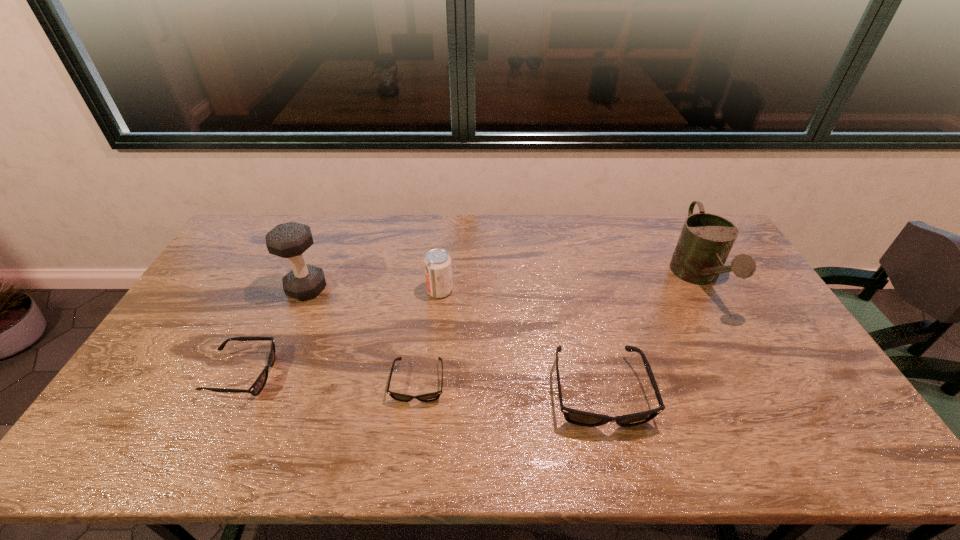
Locate an element on the screen. The width and height of the screenshot is (960, 540). the second tallest sunglasses is located at coordinates (258, 385).

The width and height of the screenshot is (960, 540). I want to click on the leftmost sunglasses, so pos(258,385).

Find the location of a particular element. the second sunglasses from right to left is located at coordinates (429, 397).

Where is `the shortest object`? the shortest object is located at coordinates (429, 397).

Locate an element on the screen. Image resolution: width=960 pixels, height=540 pixels. the second object from right to left is located at coordinates (576, 417).

You are a GUI agent. You are given a task and a screenshot of the screen. Output one action in this format:
    pyautogui.click(x=<x>, y=<y>)
    Task: Click on the rightmost sunglasses
    
    Given the screenshot: What is the action you would take?
    pyautogui.click(x=576, y=417)

The width and height of the screenshot is (960, 540). I want to click on watering can, so click(x=706, y=240).

You are a GUI agent. You are given a task and a screenshot of the screen. Output one action in this format:
    pyautogui.click(x=<x>, y=<y>)
    Task: Click on the soda can
    The height and width of the screenshot is (540, 960).
    Given the screenshot: What is the action you would take?
    pyautogui.click(x=438, y=269)

Find the location of a particular element. dumbbell is located at coordinates (290, 240).

What are the coordinates of `free space located on the front-facing side of the second tallest sunglasses` in the screenshot? It's located at (371, 375).